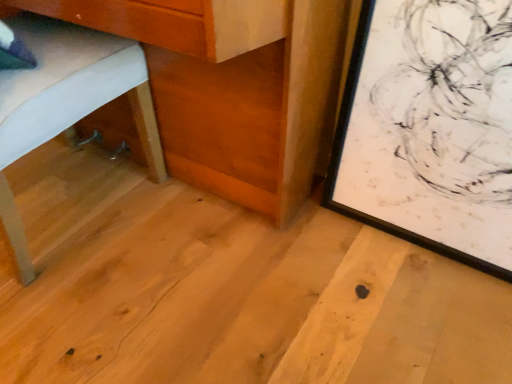
Question: Is matte white bed at left bigger or smaller than natural wood table at lower left?

Choices:
 (A) small
 (B) big

Answer: (A)

Question: From the image's perspective, is matte white bed at left located above or below natural wood table at lower left?

Choices:
 (A) below
 (B) above

Answer: (A)

Question: Based on their relative distances, which object is farther from the natural wood table at lower left?

Choices:
 (A) black matte picture frame at lower right
 (B) matte white bed at left

Answer: (A)

Question: Based on their relative distances, which object is nearer to the black matte picture frame at lower right?

Choices:
 (A) natural wood table at lower left
 (B) matte white bed at left

Answer: (A)